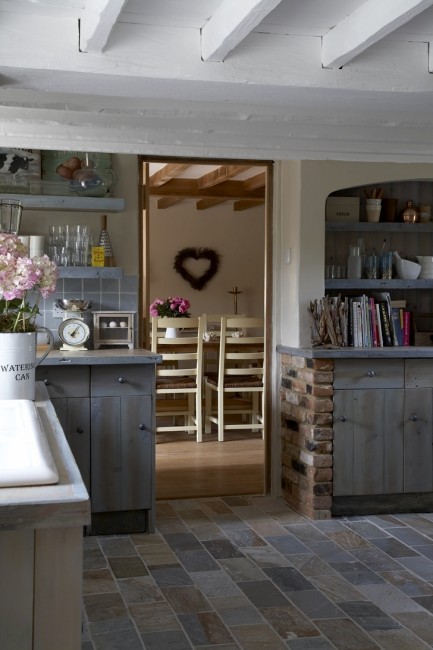
Where is `wooden beam`? The height and width of the screenshot is (650, 433). wooden beam is located at coordinates (214, 179).